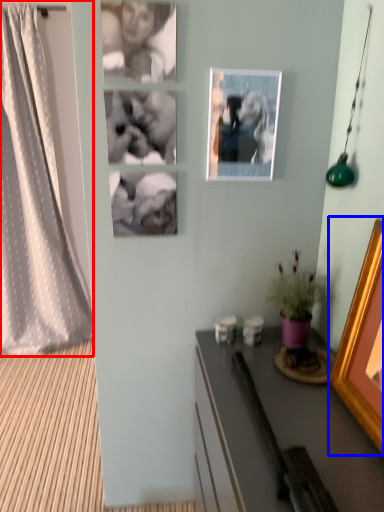
Question: Which of the following is the farthest to the observer, curtain (highlighted by a red box) or picture frame (highlighted by a blue box)?

Choices:
 (A) curtain
 (B) picture frame

Answer: (A)